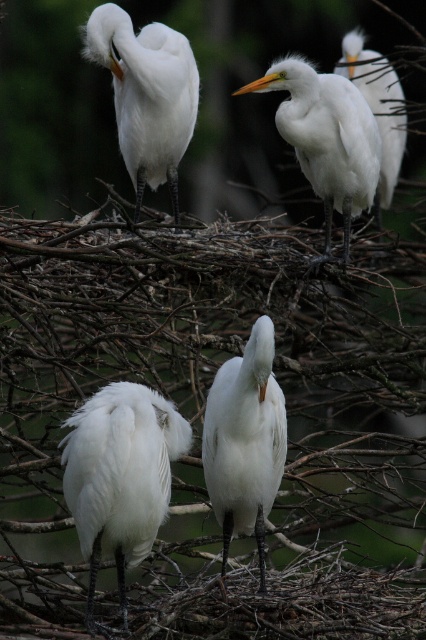
You are a photographer aiming to capture the white fluffy bird at lower left in the center of your photo. Given its current 2D position, would you need to adjust your camera to the left or right to frame it properly?

The white fluffy bird at lower left is located at point 0.747 on the x axis. Since the center of the photo is at 0.5, the bird is to the right of the center. Therefore, you should move the camera to the right to bring the bird into the frame.

You are a photographer aiming to capture a closeup of the matte white egret at upper left. Given that the camera is focused on the point at coordinates point (146, 93), will the matte white egret at upper left be in focus?

Yes, the matte white egret at upper left is exactly at point (146, 93), so it will be in focus.

You are a wildlife photographer aiming to capture the white fluffy bird at lower left and the white feathered egret at upper right in a single frame. Considering their sizes, which bird would appear larger in the photo?

The white feathered egret at upper right would appear larger in the photo because it is bigger in size compared to the white fluffy bird at lower left.